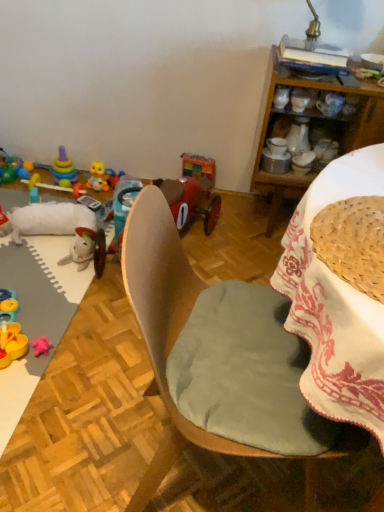
Where is `woven straw basket at upper right`? The image size is (384, 512). woven straw basket at upper right is located at coordinates (353, 242).

This screenshot has height=512, width=384. In order to click on wooden chair at center in this screenshot , I will do `click(164, 326)`.

Where is `wooden toy car at center, the first toy when ordered from right to left`? This screenshot has width=384, height=512. wooden toy car at center, the first toy when ordered from right to left is located at coordinates (190, 202).

Measure the distance between stacked plastic rings at upper left, the second toy viewed from the left, and camera.

stacked plastic rings at upper left, the second toy viewed from the left, and camera are 2.36 meters apart.

Describe the element at coordinates (61, 168) in the screenshot. I see `stacked plastic rings at upper left, which is the 4th toy from right to left` at that location.

Image resolution: width=384 pixels, height=512 pixels. Identify the location of rubber duck at lower left, arranged as the third toy when viewed from the right. (11, 343).

Where is `matte white coffee cup at upper right, which appears as the second coffee cup when viewed from the left`? This screenshot has height=512, width=384. matte white coffee cup at upper right, which appears as the second coffee cup when viewed from the left is located at coordinates coord(330,104).

This screenshot has height=512, width=384. Find the location of `woven straw basket at upper right`. woven straw basket at upper right is located at coordinates (353, 242).

Which of these two, wooden toy car at center, acting as the fifth toy starting from the left, or rubber duck at lower left, the 3th toy from the left, stands shorter?

rubber duck at lower left, the 3th toy from the left.

Could you tell me if wooden toy car at center, acting as the fifth toy starting from the left, is turned towards rubber duck at lower left, the 3th toy from the left?

Yes, wooden toy car at center, acting as the fifth toy starting from the left, is aimed at rubber duck at lower left, the 3th toy from the left.

From the image's perspective, which one is positioned higher, wooden toy car at center, the first toy when ordered from right to left, or rubber duck at lower left, the 3th toy from the left?

wooden toy car at center, the first toy when ordered from right to left, appears higher in the image.

Does wooden toy car at center, acting as the fifth toy starting from the left, touch rubber duck at lower left, arranged as the third toy when viewed from the right?

They are not placed beside each other.

Can you tell me how much wooden chair at center and wooden toy car at center, acting as the fifth toy starting from the left, differ in facing direction?

There is a 103-degree angle between the facing directions of wooden chair at center and wooden toy car at center, acting as the fifth toy starting from the left.

Are wooden chair at center and wooden toy car at center, the first toy when ordered from right to left, located far from each other?

wooden chair at center is positioned a significant distance from wooden toy car at center, the first toy when ordered from right to left.

Is wooden chair at center facing away from wooden toy car at center, the first toy when ordered from right to left?

wooden chair at center is not turned away from wooden toy car at center, the first toy when ordered from right to left.

Based on their sizes in the image, would you say wooden chair at center is bigger or smaller than wooden toy car at center, acting as the fifth toy starting from the left?

In the image, wooden chair at center appears to be larger than wooden toy car at center, acting as the fifth toy starting from the left.

From a real-world perspective, which object stands above the other?

white ceramic coffee cup at upper right, arranged as the 1th coffee cup when viewed from the left, is physically above.

Which is more to the left, wooden desk at center or white ceramic coffee cup at upper right, which is the 2th coffee cup in right-to-left order?

From the viewer's perspective, white ceramic coffee cup at upper right, which is the 2th coffee cup in right-to-left order, appears more on the left side.

Is wooden desk at center inside or outside of white ceramic coffee cup at upper right, arranged as the 1th coffee cup when viewed from the left?

wooden desk at center is spatially situated outside white ceramic coffee cup at upper right, arranged as the 1th coffee cup when viewed from the left.

Could you tell me if wooden desk at center is turned towards white ceramic coffee cup at upper right, arranged as the 1th coffee cup when viewed from the left?

No.

From a real-world perspective, which is physically above, wooden desk at center or rubber duck at left, which is counted as the fourth toy, starting from the left?

From a 3D spatial view, wooden desk at center is above.

Considering the sizes of wooden desk at center and rubber duck at left, which is counted as the fourth toy, starting from the left, in the image, is wooden desk at center bigger or smaller than rubber duck at left, which is counted as the fourth toy, starting from the left,?

In the image, wooden desk at center appears to be larger than rubber duck at left, which is counted as the fourth toy, starting from the left.

Does wooden desk at center turn towards rubber duck at left, the 2th toy viewed from the right?

No, wooden desk at center is not oriented towards rubber duck at left, the 2th toy viewed from the right.

From the image's perspective, which one is positioned higher, wooden desk at center or rubber duck at left, the 2th toy viewed from the right?

From the image's view, rubber duck at left, the 2th toy viewed from the right, is above.

From the image's perspective, between wooden toy at left and woven straw basket at upper right, who is located below?

wooden toy at left, from the image's perspective.

Between wooden toy at left and woven straw basket at upper right, which one appears on the left side from the viewer's perspective?

From the viewer's perspective, wooden toy at left appears more on the left side.

Is wooden toy at left facing towards woven straw basket at upper right?

No, wooden toy at left is not oriented towards woven straw basket at upper right.

From a real-world perspective, is wooden cabinet at upper right under stacked plastic rings at upper left, the second toy viewed from the left?

Actually, wooden cabinet at upper right is physically above stacked plastic rings at upper left, the second toy viewed from the left, in the real world.

This screenshot has height=512, width=384. I want to click on cabinetry positioned vertically above the stacked plastic rings at upper left, the second toy viewed from the left (from a real-world perspective), so click(x=314, y=125).

Is wooden cabinet at upper right not near stacked plastic rings at upper left, which is the 4th toy from right to left?

Yes.

Is stacked plastic rings at upper left, which is the 4th toy from right to left, inside wooden cabinet at upper right?

No, stacked plastic rings at upper left, which is the 4th toy from right to left, is located outside of wooden cabinet at upper right.

Based on the photo, which of these two, matte white coffee cup at upper right, which is the first coffee cup in right-to-left order, or wooden toy at left, is smaller?

matte white coffee cup at upper right, which is the first coffee cup in right-to-left order.

In the image, is matte white coffee cup at upper right, which is the first coffee cup in right-to-left order, positioned in front of or behind wooden toy at left?

In the image, matte white coffee cup at upper right, which is the first coffee cup in right-to-left order, appears behind wooden toy at left.

From a real-world perspective, which is physically below, matte white coffee cup at upper right, which is the first coffee cup in right-to-left order, or wooden toy at left?

wooden toy at left, from a real-world perspective.

Which toy is the 2nd one when counting from the left side of the wooden toy car at center, the first toy when ordered from right to left? Please provide its 2D coordinates.

[(11, 343)]

From a real-world perspective, count 1st toys downward from the wooden chair at center and point to it. Please provide its 2D coordinates.

[(190, 202)]

When comparing their distances from rubber duck at lower left, arranged as the third toy when viewed from the right, does woven straw basket at upper right or translucent plastic toy at left, the 5th toy viewed from the right, seem closer?

The object closer to rubber duck at lower left, arranged as the third toy when viewed from the right, is translucent plastic toy at left, the 5th toy viewed from the right.

Considering their positions, is wooden desk at center positioned closer to wooden toy car at center, acting as the fifth toy starting from the left, than rubber duck at lower left, arranged as the third toy when viewed from the right?

rubber duck at lower left, arranged as the third toy when viewed from the right.

Considering their positions, is white ceramic coffee cup at upper right, arranged as the 1th coffee cup when viewed from the left, positioned closer to translucent plastic toy at left, the 5th toy viewed from the right, than rubber duck at lower left, arranged as the third toy when viewed from the right?

rubber duck at lower left, arranged as the third toy when viewed from the right, lies closer to translucent plastic toy at left, the 5th toy viewed from the right, than the other object.

When comparing their distances from wooden chair at center, does translucent plastic toy at left, the 5th toy viewed from the right, or wooden toy car at center, acting as the fifth toy starting from the left, seem closer?

→ Among the two, wooden toy car at center, acting as the fifth toy starting from the left, is located nearer to wooden chair at center.

Which object lies nearer to the anchor point wooden desk at center, wooden cabinet at upper right or stacked plastic rings at upper left, the second toy viewed from the left?

Based on the image, wooden cabinet at upper right appears to be nearer to wooden desk at center.

Which object lies nearer to the anchor point translucent plastic toy at left, which is counted as the 1th toy, starting from the left, woven straw basket at upper right or wooden desk at center?

wooden desk at center is positioned closer to the anchor translucent plastic toy at left, which is counted as the 1th toy, starting from the left.

Based on their spatial positions, is rubber duck at left, the 2th toy viewed from the right, or stacked plastic rings at upper left, which is the 4th toy from right to left, further from wooden cabinet at upper right?

stacked plastic rings at upper left, which is the 4th toy from right to left.

Which object lies nearer to the anchor point rubber duck at lower left, arranged as the third toy when viewed from the right, wooden chair at center or woven straw basket at upper right?

wooden chair at center.

The image size is (384, 512). What are the coordinates of `chair situated between wooden toy at left and wooden desk at center from left to right` in the screenshot? It's located at (164, 326).

Where is `chair between wooden desk at center and stacked plastic rings at upper left, which is the 4th toy from right to left, in the front-back direction`? chair between wooden desk at center and stacked plastic rings at upper left, which is the 4th toy from right to left, in the front-back direction is located at coordinates (164, 326).

Where is `basket between wooden toy at left and wooden cabinet at upper right`? basket between wooden toy at left and wooden cabinet at upper right is located at coordinates (353, 242).

Find the location of `cabinetry between wooden chair at center and translucent plastic toy at left, which is counted as the 1th toy, starting from the left, in the front-back direction`. cabinetry between wooden chair at center and translucent plastic toy at left, which is counted as the 1th toy, starting from the left, in the front-back direction is located at coordinates (314, 125).